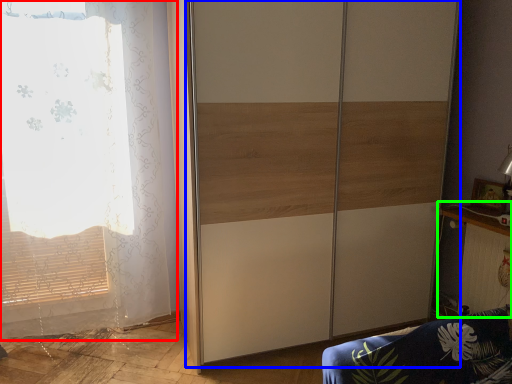
Question: Which object is positioned closest to curtain (highlighted by a red box)? Select from screen door (highlighted by a blue box) and table (highlighted by a green box).

Choices:
 (A) screen door
 (B) table

Answer: (A)